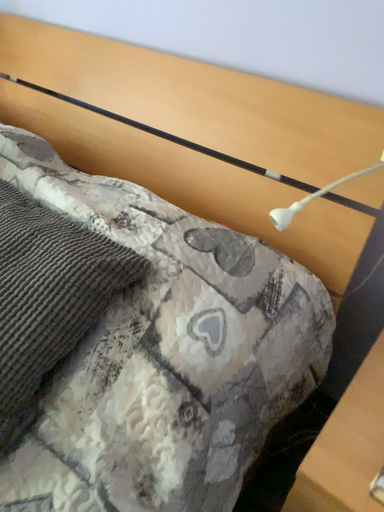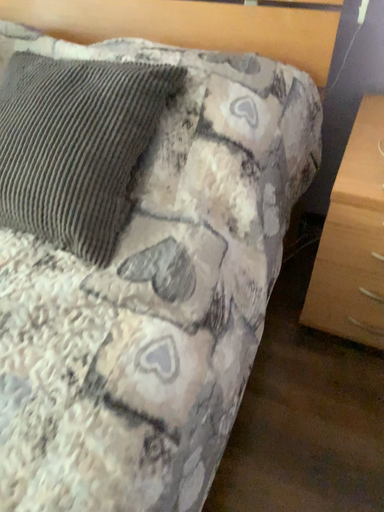
Question: How did the camera likely rotate when shooting the video?

Choices:
 (A) rotated right
 (B) rotated left

Answer: (A)